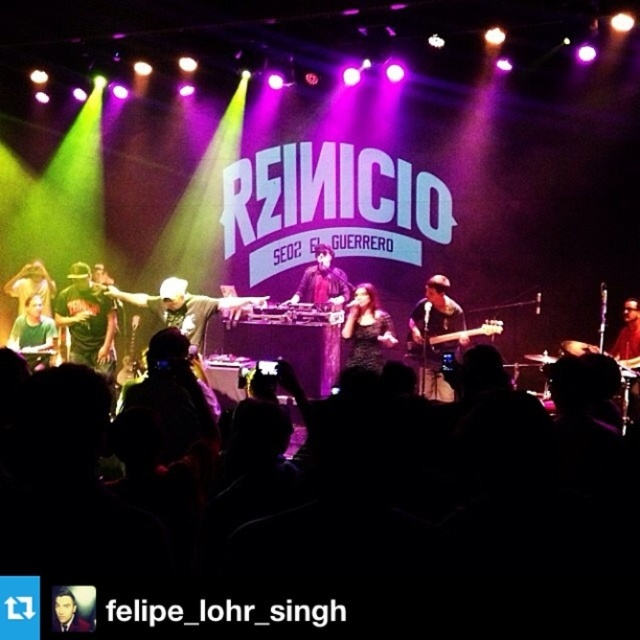
Can you confirm if matte black dj booth at center is positioned to the right of matte black shirt at center?

Indeed, matte black dj booth at center is positioned on the right side of matte black shirt at center.

Looking at this image, can you confirm if matte black dj booth at center is thinner than matte black shirt at center?

Correct, matte black dj booth at center's width is less than matte black shirt at center's.

Where is `matte black dj booth at center`? The width and height of the screenshot is (640, 640). matte black dj booth at center is located at coordinates (323, 282).

Can you confirm if dark green shirt at center is positioned to the right of black matte turntable at center?

No, dark green shirt at center is not to the right of black matte turntable at center.

Is the position of dark green shirt at center more distant than that of black matte turntable at center?

That is False.

Find the location of `dark green shirt at center`. dark green shirt at center is located at coordinates (86, 321).

Is point (76, 262) farther from camera compared to point (20, 284)?

No, it is not.

The width and height of the screenshot is (640, 640). What are the coordinates of `dark green shirt at center` in the screenshot? It's located at (86, 321).